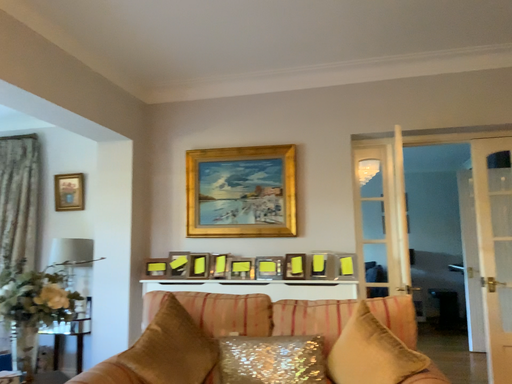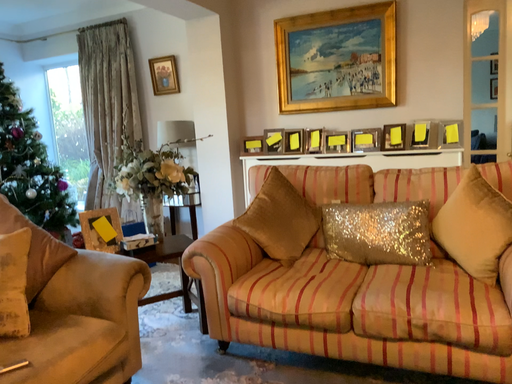
Question: How did the camera likely rotate when shooting the video?

Choices:
 (A) rotated right
 (B) rotated left

Answer: (B)